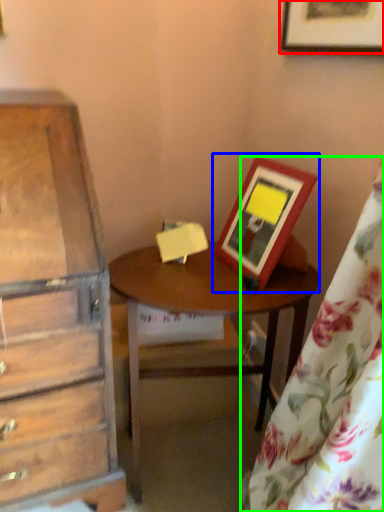
Question: Which object is the closest to the picture frame (highlighted by a red box)? Choose among these: picture frame (highlighted by a blue box) or curtain (highlighted by a green box).

Choices:
 (A) picture frame
 (B) curtain

Answer: (A)